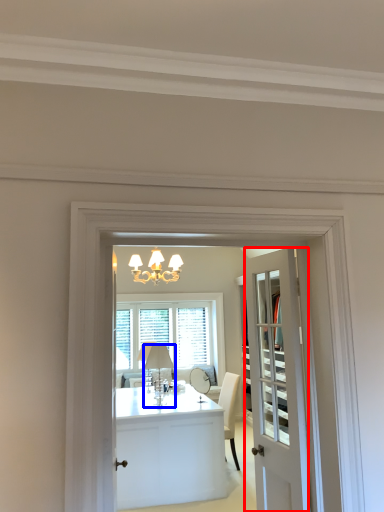
Question: Which of the following is the closest to the observer, door (highlighted by a red box) or lamp (highlighted by a blue box)?

Choices:
 (A) door
 (B) lamp

Answer: (A)